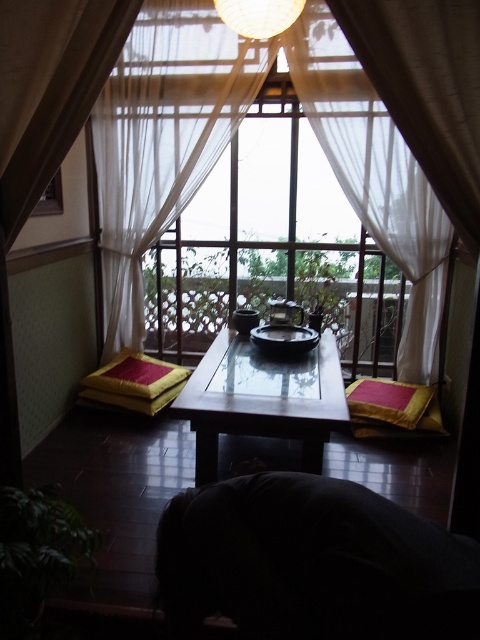
You are standing in the room and want to adjust the white sheer curtain at center. If you face the window, which side should you move towards to reach the curtain?

The white sheer curtain at center is located at point 0.220 on the x axis and 0.475 on the y axis. Since the curtains are typically at the sides of the window, but in this case, the curtain is at the center, you should move towards the center of the window to adjust it.

You are standing in the room and want to reach the point marked as point (x=227, y=124). If your arm can reach up to 1.8 meters, can you touch it without moving your feet?

The point (x=227, y=124) is 3.42 meters away from the camera, which is farther than your arm can reach. You cannot touch it without moving your feet.